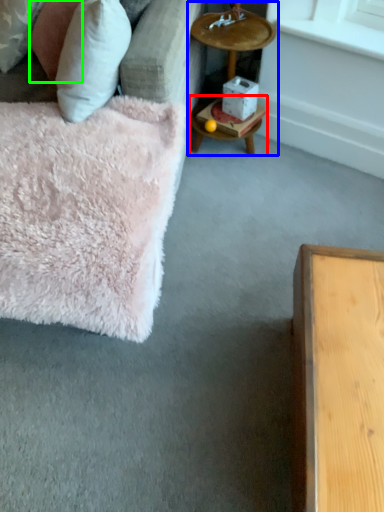
Question: Based on their relative distances, which object is nearer to table (highlighted by a red box)? Choose from cocktail table (highlighted by a blue box) and pillow (highlighted by a green box).

Choices:
 (A) cocktail table
 (B) pillow

Answer: (A)